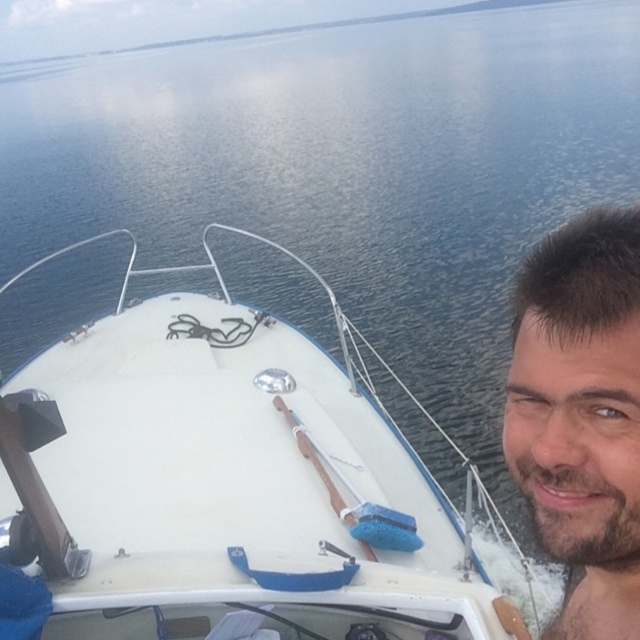
In the scene shown: Which is below, white matte boat at center or bearded man at right?

bearded man at right is lower down.

Does white matte boat at center have a lesser width compared to bearded man at right?

Incorrect, white matte boat at center's width is not less than bearded man at right's.

Identify the location of white matte boat at center. Image resolution: width=640 pixels, height=640 pixels. (225, 484).